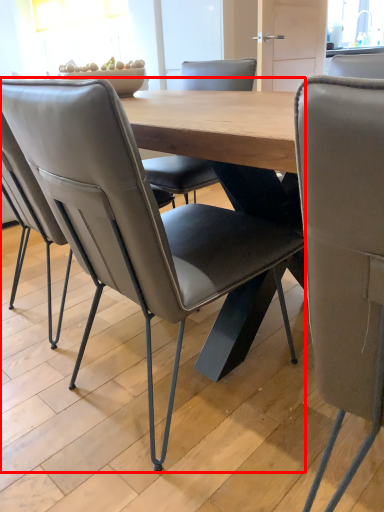
Question: From the image's perspective, where is chair (annotated by the red box) located in relation to chair in the image?

Choices:
 (A) below
 (B) above

Answer: (B)